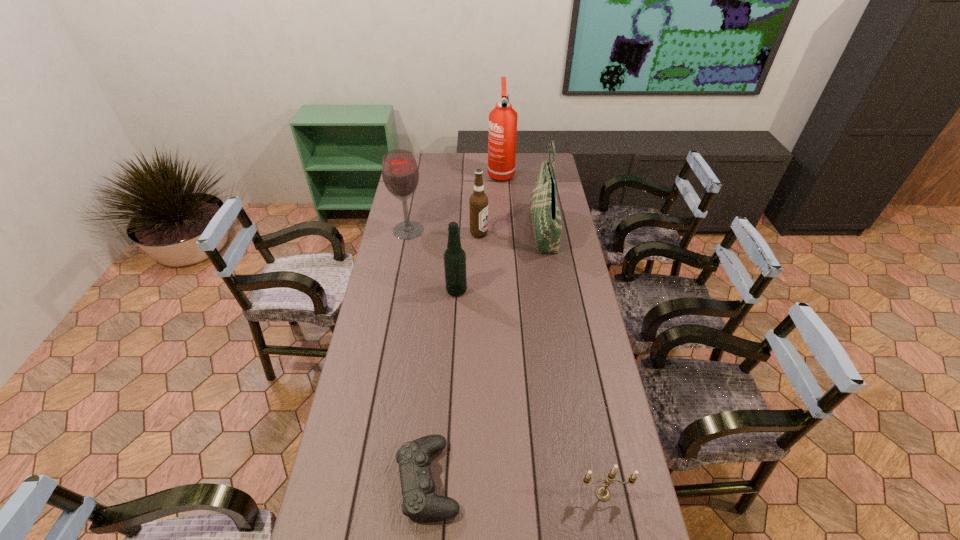
What are the coordinates of `fire extinguisher` in the screenshot? It's located at (502, 134).

Where is `the farthest object`? The height and width of the screenshot is (540, 960). the farthest object is located at coordinates (502, 134).

At what (x,y) coordinates should I click in order to perform the action: click on tote bag. Please return your answer as a coordinate pair (x, y). The image size is (960, 540). Looking at the image, I should click on (546, 219).

This screenshot has width=960, height=540. I want to click on the leftmost alcohol, so click(x=400, y=173).

You are a GUI agent. You are given a task and a screenshot of the screen. Output one action in this format:
    pyautogui.click(x=<x>, y=<y>)
    Task: Click on the nearest alcohol
    
    Given the screenshot: What is the action you would take?
    pyautogui.click(x=454, y=257)

The width and height of the screenshot is (960, 540). Identify the location of the fifth farthest object. (454, 257).

Where is `the rightmost alcohol`? The height and width of the screenshot is (540, 960). the rightmost alcohol is located at coordinates (478, 202).

The width and height of the screenshot is (960, 540). What are the coordinates of `candle` in the screenshot? It's located at (602, 492).

Where is `the shortest object`? The image size is (960, 540). the shortest object is located at coordinates (420, 501).

In order to click on free location located 0.080m at the nozzle of the farthest object in this screenshot , I will do `click(502, 192)`.